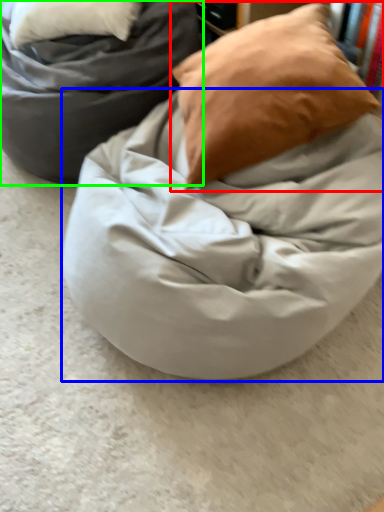
Question: Considering the real-world distances, which object is farthest from pillow (highlighted by a red box)? blanket (highlighted by a blue box) or furniture (highlighted by a green box)?

Choices:
 (A) blanket
 (B) furniture

Answer: (B)